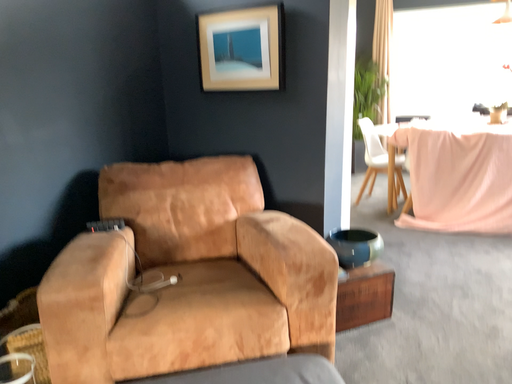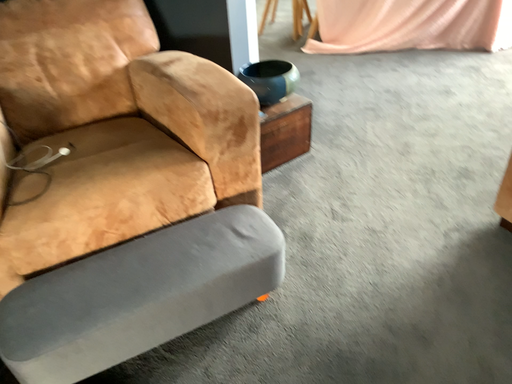
Question: Which way did the camera rotate in the video?

Choices:
 (A) rotated left
 (B) rotated right

Answer: (B)